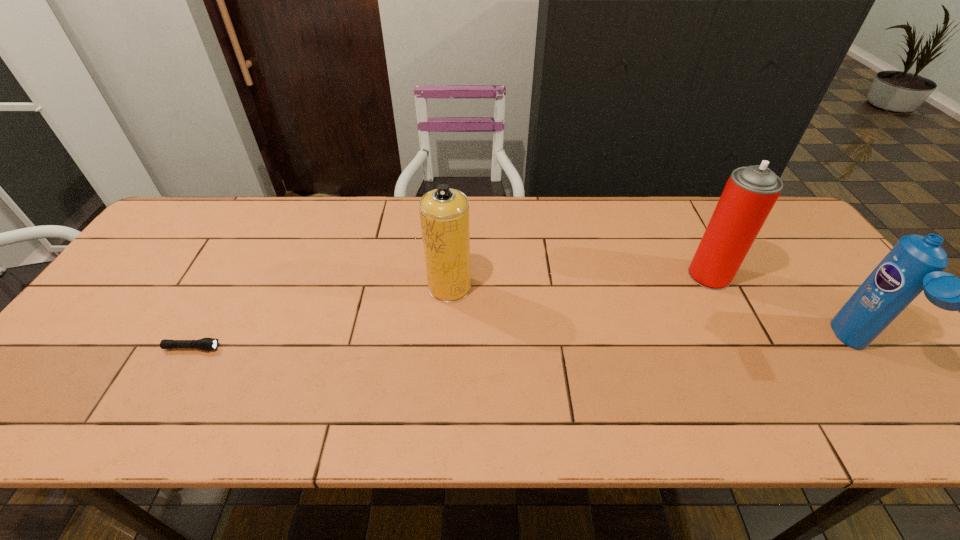
Where is `vacant area at the far edge of the desktop`? vacant area at the far edge of the desktop is located at coordinates (341, 233).

Locate an element on the screen. This screenshot has height=540, width=960. free space at the left edge of the desktop is located at coordinates (115, 352).

Locate an element on the screen. vacant area at the right edge is located at coordinates pos(800,251).

The image size is (960, 540). In the image, there is a desktop. Identify the location of vacant space at the far left corner. (188, 213).

Find the location of `free space at the far right corner of the desktop`. free space at the far right corner of the desktop is located at coordinates (783, 213).

Identify the location of vacant point located between the flashlight and the right aerosol can. Image resolution: width=960 pixels, height=540 pixels. (450, 312).

Where is `free space between the right aerosol can and the rightmost object`? This screenshot has height=540, width=960. free space between the right aerosol can and the rightmost object is located at coordinates (783, 312).

Locate an element on the screen. The height and width of the screenshot is (540, 960). free space between the rightmost object and the second object from right to left is located at coordinates (783, 312).

You are a GUI agent. You are given a task and a screenshot of the screen. Output one action in this format:
    pyautogui.click(x=<x>, y=<y>)
    Task: Click on the vacant area that lies between the third object from left to right and the left aerosol can
    The width and height of the screenshot is (960, 540).
    Given the screenshot: What is the action you would take?
    pyautogui.click(x=580, y=281)

You are a GUI agent. You are given a task and a screenshot of the screen. Output one action in this format:
    pyautogui.click(x=<x>, y=<y>)
    Task: Click on the blank region between the second object from left to right and the flashlight
    The width and height of the screenshot is (960, 540).
    Given the screenshot: What is the action you would take?
    pyautogui.click(x=321, y=318)